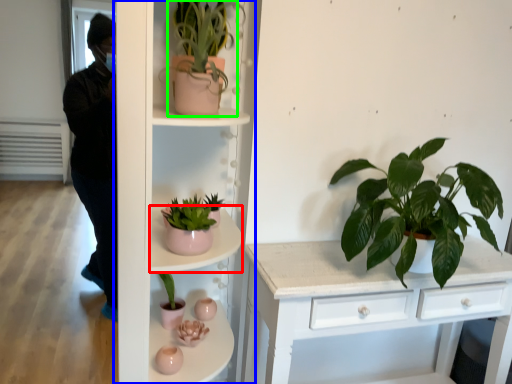
Question: Which is nearer to the shelf (highlighted by a red box)? shelf (highlighted by a blue box) or houseplant (highlighted by a green box).

Choices:
 (A) shelf
 (B) houseplant

Answer: (A)